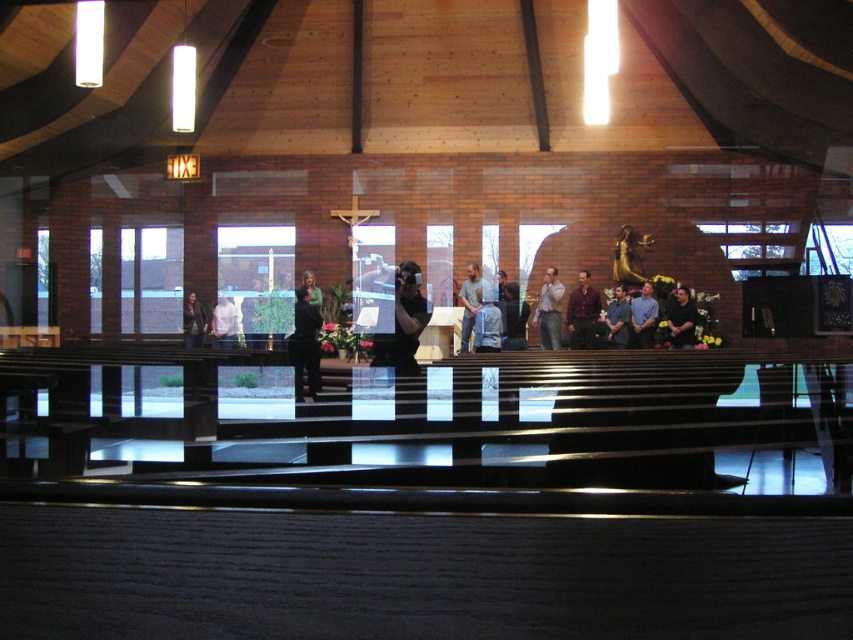
You are a photographer setting up for an event in this modern church. You notice two shirts on the stage area. The gray cotton shirt at center and the white shirt at center. Which shirt is positioned higher in the scene?

The gray cotton shirt at center is located above the white shirt at center, so the gray cotton shirt at center is positioned higher in the scene.

You are a photographer standing at the back of the modern church. You want to take a photo of the gray cotton shirt at center and the white shirt at center so that both are in focus. The camera you are using has a depth of field that can cover 10 feet. Will both shirts be in focus in the photo?

The gray cotton shirt at center and white shirt at center are 12.50 feet apart from each other. Since the depth of field can only cover 10 feet, both shirts will not be in focus in the photo.

You are attending a service in the modern church and notice two people wearing different colored shirts. The black shirt at right and the blue shirt at center. From your perspective facing the stage, which shirt is located to the left of the other?

The blue shirt at center is to the left of the black shirt at right because the black shirt at right is positioned on the right side of the blue shirt at center.